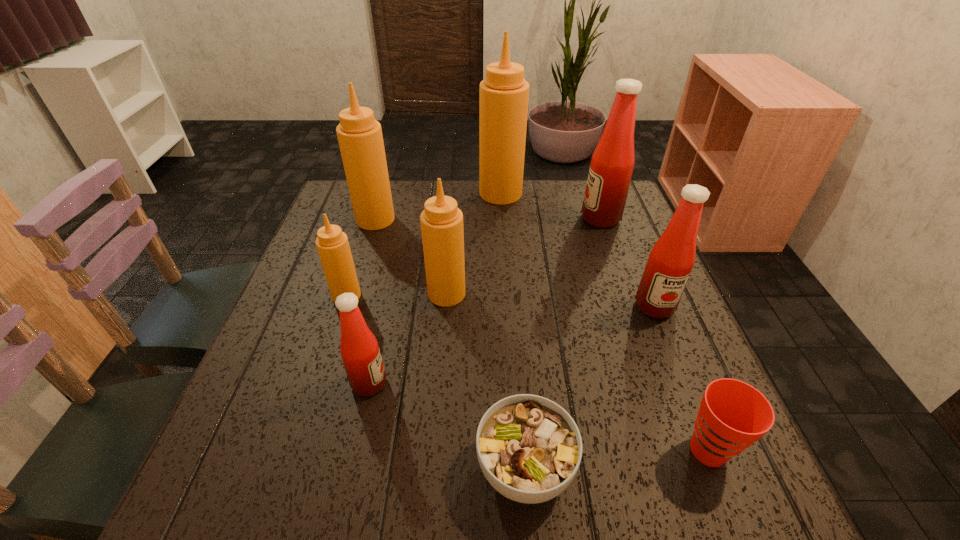
Locate an element on the screen. This screenshot has height=540, width=960. vacant space at the far edge of the desktop is located at coordinates (452, 190).

Find the location of a particular element. The width and height of the screenshot is (960, 540). vacant area at the left edge of the desktop is located at coordinates (305, 325).

In the image, there is a desktop. At what (x,y) coordinates should I click in order to perform the action: click on vacant space at the right edge. Please return your answer as a coordinate pair (x, y). The image size is (960, 540). Looking at the image, I should click on (624, 262).

The width and height of the screenshot is (960, 540). In order to click on free point at the near right corner in this screenshot , I will do `click(768, 514)`.

Identify the location of free area in between the cup and the smallest tan condiment. The width and height of the screenshot is (960, 540). (527, 373).

The height and width of the screenshot is (540, 960). What are the coordinates of `vacant area that lies between the smallest tan condiment and the second biggest red condiment` in the screenshot? It's located at (500, 301).

This screenshot has height=540, width=960. I want to click on vacant space in between the cup and the shortest object, so click(x=616, y=459).

Identify the location of free space that is in between the rightmost tan condiment and the cup. This screenshot has width=960, height=540. (605, 322).

I want to click on blank region between the farthest red condiment and the second farthest tan condiment, so click(488, 219).

The width and height of the screenshot is (960, 540). I want to click on free space between the farthest red condiment and the second smallest red condiment, so click(x=628, y=262).